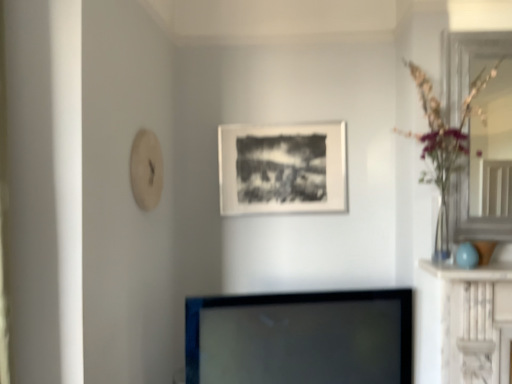
Question: In terms of size, does clear glass vase at right appear bigger or smaller than matte black picture frame at center?

Choices:
 (A) small
 (B) big

Answer: (B)

Question: In the image, is clear glass vase at right on the left side or the right side of matte black picture frame at center?

Choices:
 (A) left
 (B) right

Answer: (B)

Question: Considering the real-world distances, which object is farthest from the clear glass vase at right?

Choices:
 (A) matte black picture frame at center
 (B) black glossy tv at center
 (C) clear glass door at right

Answer: (B)

Question: Estimate the real-world distances between objects in this image. Which object is farther from the clear glass door at right?

Choices:
 (A) clear glass vase at right
 (B) black glossy tv at center
 (C) matte black picture frame at center

Answer: (B)